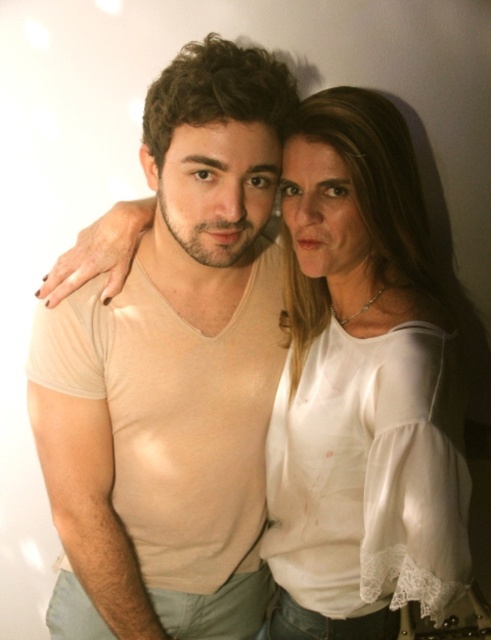
Question: Is matte beige t-shirt at center smaller than white satin blouse at center?

Choices:
 (A) no
 (B) yes

Answer: (A)

Question: Is matte beige t-shirt at center bigger than white satin blouse at center?

Choices:
 (A) yes
 (B) no

Answer: (A)

Question: Is matte beige t-shirt at center smaller than white satin blouse at center?

Choices:
 (A) no
 (B) yes

Answer: (A)